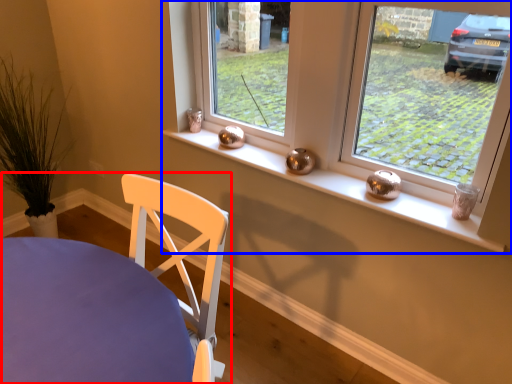
Question: Which object is further to the camera taking this photo, chair (highlighted by a red box) or window (highlighted by a blue box)?

Choices:
 (A) chair
 (B) window

Answer: (B)